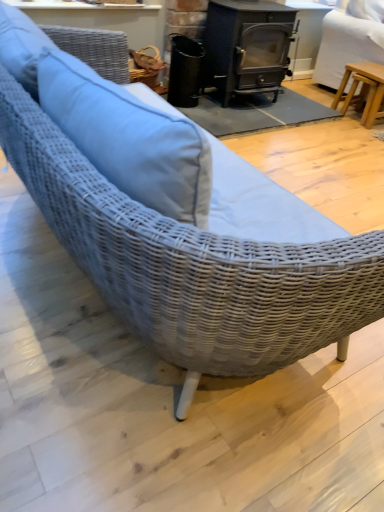
What do you see at coordinates (363, 90) in the screenshot? I see `light brown wooden stool at right` at bounding box center [363, 90].

This screenshot has height=512, width=384. I want to click on light brown wooden stool at right, so click(x=346, y=46).

Find the location of `black matte trash can at center`. black matte trash can at center is located at coordinates click(x=184, y=71).

Is light brown wooden stool at right at the back of black cast iron wood burning stove at center?

That's not correct — black cast iron wood burning stove at center is not looking away from light brown wooden stool at right.

The height and width of the screenshot is (512, 384). What are the coordinates of `swivel chair that appears on the right of black cast iron wood burning stove at center` in the screenshot? It's located at (346, 46).

From a real-world perspective, who is located lower, black cast iron wood burning stove at center or light brown wooden stool at right?

From a 3D spatial view, light brown wooden stool at right is below.

Is black cast iron wood burning stove at center beside light brown wooden stool at right?

They are not placed beside each other.

Considering the sizes of light brown wooden stool at right and light brown wooden stool at right in the image, is light brown wooden stool at right bigger or smaller than light brown wooden stool at right?

Clearly, light brown wooden stool at right is smaller in size than light brown wooden stool at right.

Where is `swivel chair lying above the light brown wooden stool at right (from the image's perspective)`? This screenshot has height=512, width=384. swivel chair lying above the light brown wooden stool at right (from the image's perspective) is located at coordinates (346, 46).

From the image's perspective, is light brown wooden stool at right on top of light brown wooden stool at right?

No, from the image's perspective, light brown wooden stool at right is not over light brown wooden stool at right.

How far apart are light brown wooden stool at right and black cast iron wood burning stove at center?

light brown wooden stool at right and black cast iron wood burning stove at center are 31.79 inches apart.

Based on the photo, how different are the orientations of light brown wooden stool at right and black cast iron wood burning stove at center in degrees?

They differ by 15.8 degrees in their facing directions.

Considering the sizes of light brown wooden stool at right and black cast iron wood burning stove at center in the image, is light brown wooden stool at right bigger or smaller than black cast iron wood burning stove at center?

Clearly, light brown wooden stool at right is smaller in size than black cast iron wood burning stove at center.

Is black cast iron wood burning stove at center located within light brown wooden stool at right?

No, black cast iron wood burning stove at center is not surrounded by light brown wooden stool at right.

How distant is black matte trash can at center from light brown wooden stool at right?

black matte trash can at center and light brown wooden stool at right are 1.28 meters apart.

From the image's perspective, does black matte trash can at center appear lower than light brown wooden stool at right?

No, from the image's perspective, black matte trash can at center is not beneath light brown wooden stool at right.

What's the angular difference between black matte trash can at center and light brown wooden stool at right's facing directions?

14.6 degrees.

In the image, is black matte trash can at center positioned in front of or behind light brown wooden stool at right?

Clearly, black matte trash can at center is in front of light brown wooden stool at right.

From a real-world perspective, between black cast iron wood burning stove at center and black matte trash can at center, who is vertically lower?

From a 3D spatial view, black matte trash can at center is below.

Does point (244, 21) come behind point (186, 83)?

No, (244, 21) is closer to viewer.

Considering the sizes of black cast iron wood burning stove at center and black matte trash can at center in the image, is black cast iron wood burning stove at center wider or thinner than black matte trash can at center?

black cast iron wood burning stove at center is wider than black matte trash can at center.

Which of these two, black cast iron wood burning stove at center or black matte trash can at center, stands taller?

Standing taller between the two is black cast iron wood burning stove at center.

From a real-world perspective, who is located lower, black matte trash can at center or black cast iron wood burning stove at center?

black matte trash can at center is physically lower.

Which of these two, black matte trash can at center or black cast iron wood burning stove at center, stands taller?

black cast iron wood burning stove at center is taller.

Considering the sizes of objects black matte trash can at center and black cast iron wood burning stove at center in the image provided, who is bigger, black matte trash can at center or black cast iron wood burning stove at center?

black cast iron wood burning stove at center.

Where is `appliance to the left of black cast iron wood burning stove at center`? The width and height of the screenshot is (384, 512). appliance to the left of black cast iron wood burning stove at center is located at coordinates (184, 71).

Is light brown wooden stool at right not inside black matte trash can at center?

Yes, light brown wooden stool at right is not within black matte trash can at center.

Find the location of a particular element. appliance located above the light brown wooden stool at right (from a real-world perspective) is located at coordinates (184, 71).

In terms of width, does light brown wooden stool at right look wider or thinner when compared to black matte trash can at center?

Considering their sizes, light brown wooden stool at right looks slimmer than black matte trash can at center.

Which of these two, light brown wooden stool at right or black matte trash can at center, stands shorter?

light brown wooden stool at right is shorter.

Locate an element on the screen. This screenshot has height=512, width=384. swivel chair on the right of black cast iron wood burning stove at center is located at coordinates (346, 46).

You are a GUI agent. You are given a task and a screenshot of the screen. Output one action in this format:
    pyautogui.click(x=<x>, y=<y>)
    Task: Click on the table below the light brown wooden stool at right (from a real-world perspective)
    
    Given the screenshot: What is the action you would take?
    (x=363, y=90)

Consider the image. Considering their positions, is light brown wooden stool at right positioned further to black cast iron wood burning stove at center than light brown wooden stool at right?

The object further to black cast iron wood burning stove at center is light brown wooden stool at right.

Looking at the image, which one is located further to light brown wooden stool at right, black cast iron wood burning stove at center or light brown wooden stool at right?

Among the two, black cast iron wood burning stove at center is located further to light brown wooden stool at right.

Considering their positions, is black matte trash can at center positioned closer to light brown wooden stool at right than black cast iron wood burning stove at center?

Based on the image, black cast iron wood burning stove at center appears to be nearer to light brown wooden stool at right.

Looking at the image, which one is located further to black matte trash can at center, light brown wooden stool at right or black cast iron wood burning stove at center?

light brown wooden stool at right lies further to black matte trash can at center than the other object.

Estimate the real-world distances between objects in this image. Which object is further from light brown wooden stool at right, light brown wooden stool at right or black cast iron wood burning stove at center?

Based on the image, black cast iron wood burning stove at center appears to be further to light brown wooden stool at right.

Estimate the real-world distances between objects in this image. Which object is further from light brown wooden stool at right, light brown wooden stool at right or black matte trash can at center?

black matte trash can at center is further to light brown wooden stool at right.

Estimate the real-world distances between objects in this image. Which object is closer to black cast iron wood burning stove at center, black matte trash can at center or light brown wooden stool at right?

The object closer to black cast iron wood burning stove at center is black matte trash can at center.

Estimate the real-world distances between objects in this image. Which object is further from black cast iron wood burning stove at center, light brown wooden stool at right or light brown wooden stool at right?

Among the two, light brown wooden stool at right is located further to black cast iron wood burning stove at center.

The image size is (384, 512). In order to click on wood burning stove between black matte trash can at center and light brown wooden stool at right in this screenshot , I will do `click(246, 47)`.

Locate an element on the screen. This screenshot has height=512, width=384. wood burning stove between black matte trash can at center and light brown wooden stool at right from left to right is located at coordinates (246, 47).

This screenshot has height=512, width=384. I want to click on table between black cast iron wood burning stove at center and light brown wooden stool at right, so click(363, 90).

Find the location of a particular element. This screenshot has width=384, height=512. table between black matte trash can at center and light brown wooden stool at right in the horizontal direction is located at coordinates (363, 90).